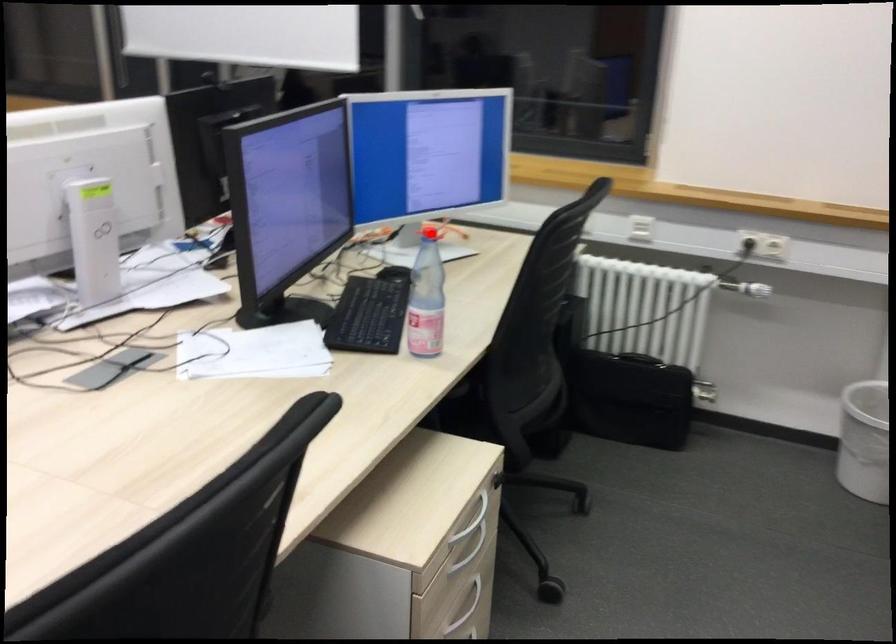
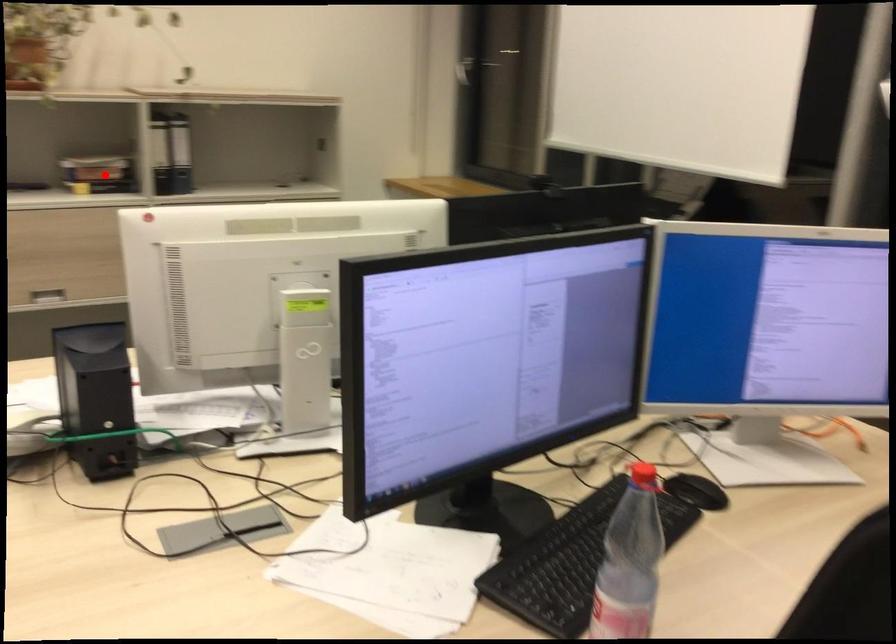
I am providing you with two images of the same scene from different viewpoints. A red point is marked on the first image and another point is marked on the second image. Is the red point in image1 aligned with the point shown in image2?

No